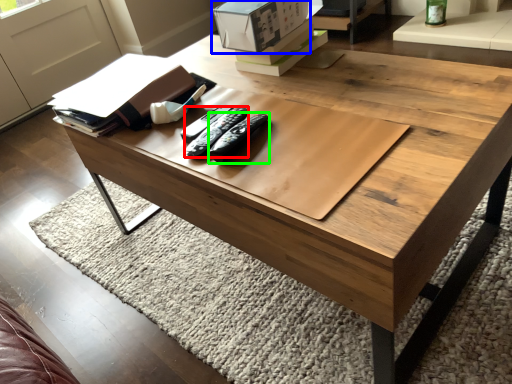
Question: Which object is positioned farthest from remote (highlighted by a red box)? Select from cardboard box (highlighted by a blue box) and remote (highlighted by a green box).

Choices:
 (A) cardboard box
 (B) remote

Answer: (A)